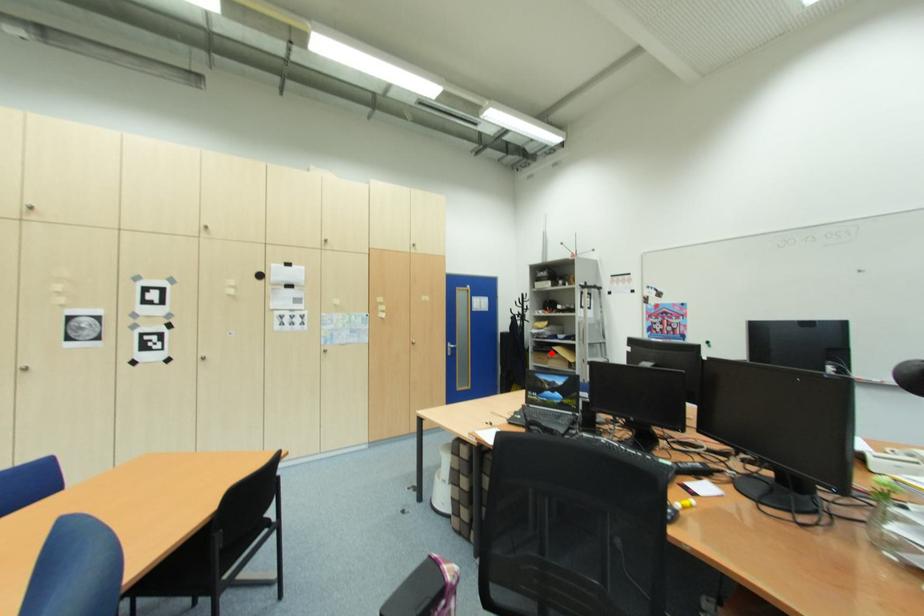
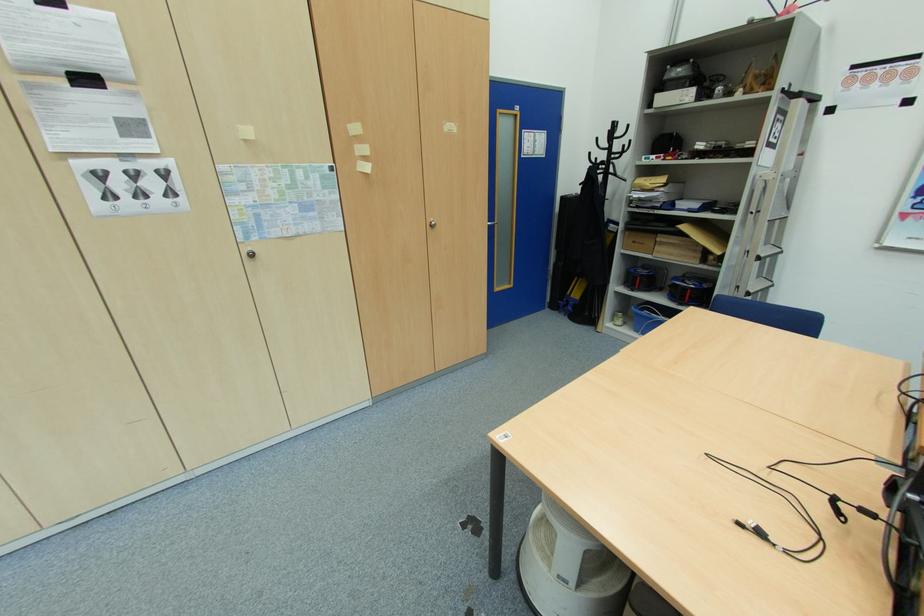
Locate, in the second image, the point that corresponds to the highlighted location in the first image.

(660, 233)